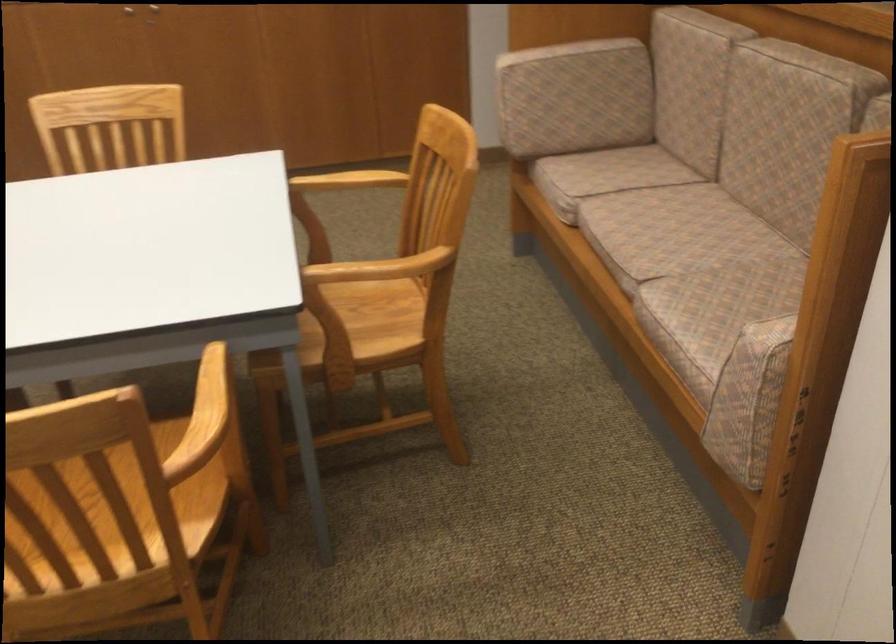
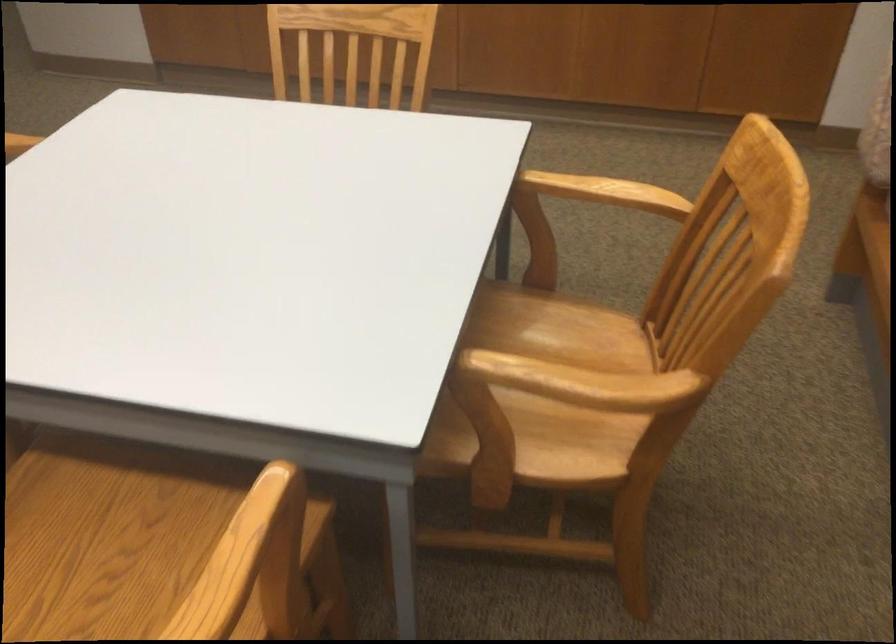
Where in the second image is the point corresponding to the point at 381,263 from the first image?

(583, 383)